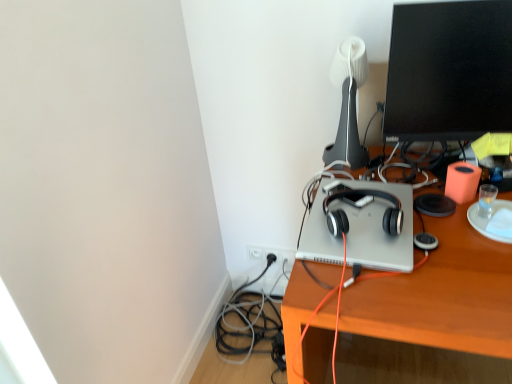
You are a GUI agent. You are given a task and a screenshot of the screen. Output one action in this format:
    pyautogui.click(x=<x>, y=<y>)
    Task: Click on the vacant region above silver metallic laptop at center (from a real-world perspective)
    This screenshot has width=512, height=384.
    Given the screenshot: What is the action you would take?
    pyautogui.click(x=358, y=205)